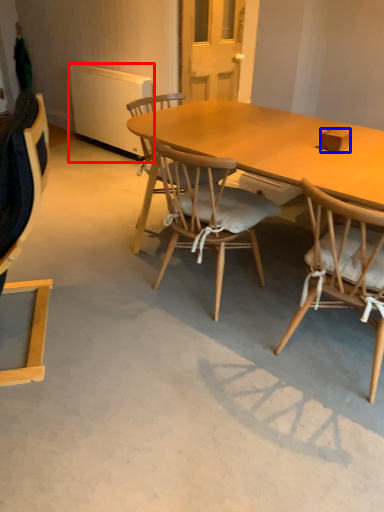
Question: Which of the following is the farthest to the observer, radiator (highlighted by a red box) or box (highlighted by a blue box)?

Choices:
 (A) radiator
 (B) box

Answer: (A)